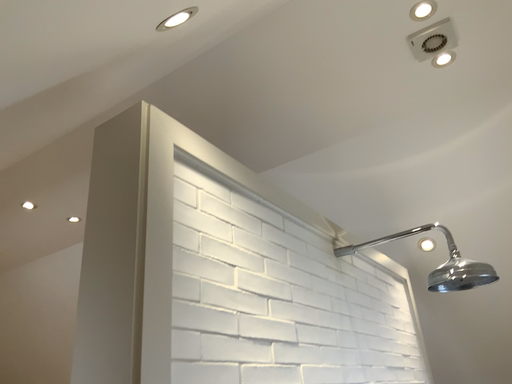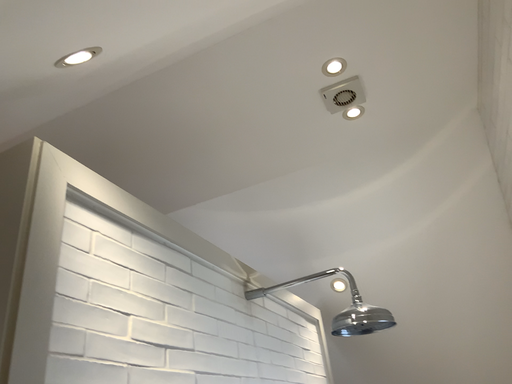
Question: How did the camera likely rotate when shooting the video?

Choices:
 (A) rotated right
 (B) rotated left

Answer: (A)